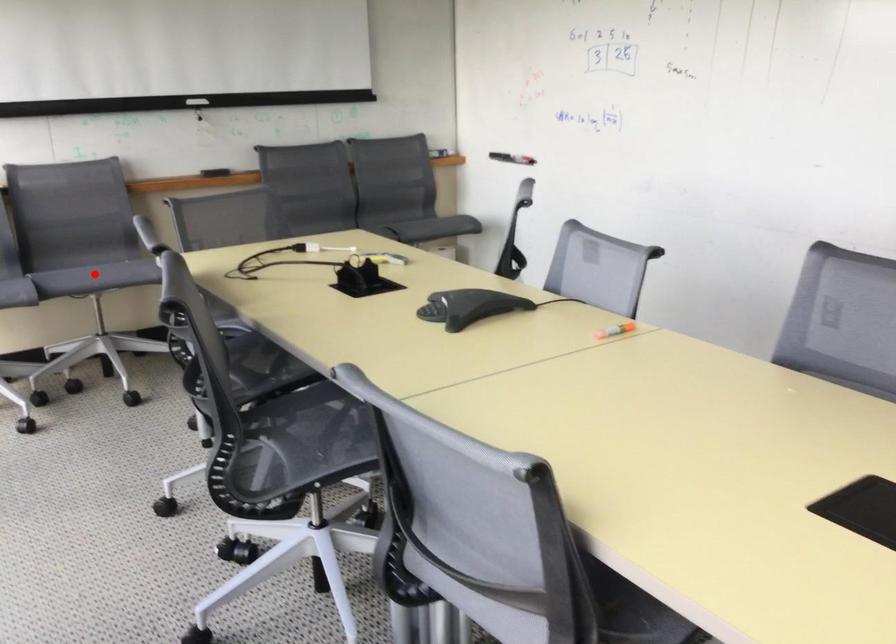
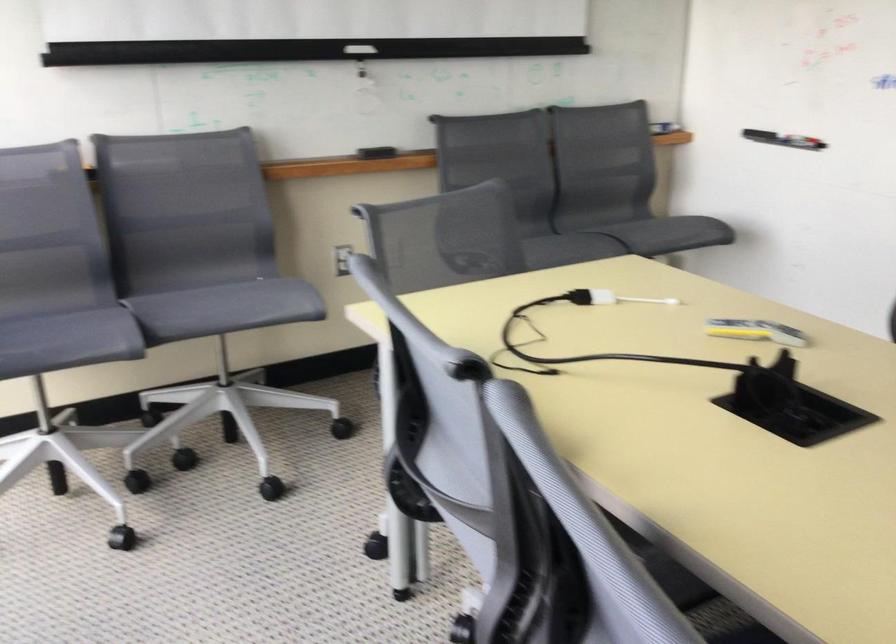
Locate, in the second image, the point that corresponds to the highlighted location in the first image.

(225, 308)